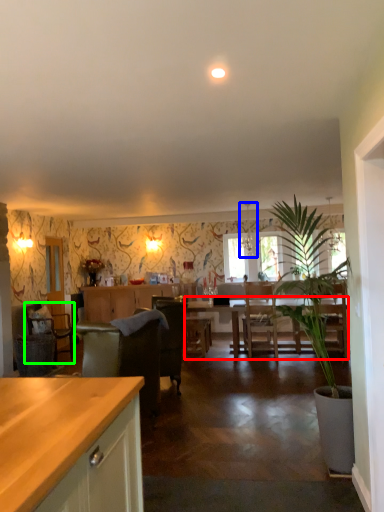
Question: Estimate the real-world distances between objects in this image. Which object is closer to kitchen & dining room table (highlighted by a red box), lamp (highlighted by a blue box) or chair (highlighted by a green box)?

Choices:
 (A) lamp
 (B) chair

Answer: (A)